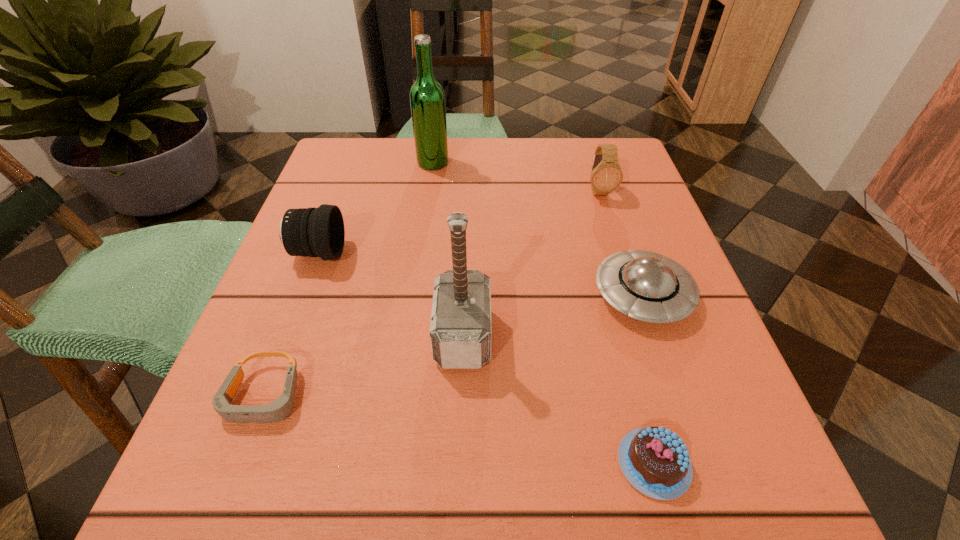
The width and height of the screenshot is (960, 540). Identify the location of the fifth object from right to left. (427, 98).

This screenshot has width=960, height=540. I want to click on beer bottle, so click(427, 98).

Where is `the fourth object from left to right`? The width and height of the screenshot is (960, 540). the fourth object from left to right is located at coordinates (460, 329).

Find the location of a particular element. hammer is located at coordinates (460, 329).

Find the location of `the second farthest object`. the second farthest object is located at coordinates (606, 175).

The width and height of the screenshot is (960, 540). Identify the location of telephoto lens. (315, 232).

This screenshot has height=540, width=960. Identify the location of saucer. (649, 287).

Identify the location of the sixth tallest object. (654, 460).

At what (x,y) coordinates should I click in order to perform the action: click on goggles. Please return your answer as a coordinate pair (x, y). Image resolution: width=960 pixels, height=540 pixels. Looking at the image, I should click on (280, 408).

Find the location of a particular element. This screenshot has width=960, height=540. vacant space located on the right of the farthest object is located at coordinates (540, 163).